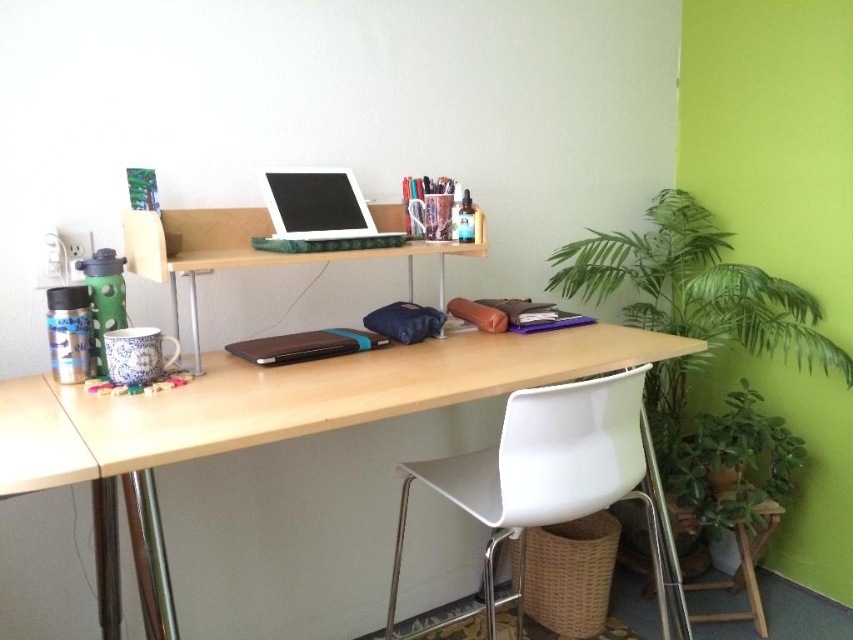
Question: Estimate the real-world distances between objects in this image. Which object is farther from the green marble laptop at center?

Choices:
 (A) green leafy plant at lower right
 (B) brown leather laptop at center

Answer: (A)

Question: Is green leafy plant at right below green marble laptop at center?

Choices:
 (A) yes
 (B) no

Answer: (A)

Question: Can you confirm if light wood/woodendesk at center is positioned to the left of green leafy plant at right?

Choices:
 (A) no
 (B) yes

Answer: (B)

Question: Does light wood/woodendesk at center appear on the right side of green leafy plant at lower right?

Choices:
 (A) yes
 (B) no

Answer: (B)

Question: Which of the following is the farthest from the observer?

Choices:
 (A) (253, 346)
 (B) (763, 545)
 (C) (379, 392)
 (D) (282, 189)

Answer: (B)

Question: Which point is farther from the camera taking this photo?

Choices:
 (A) (279, 349)
 (B) (399, 387)

Answer: (A)